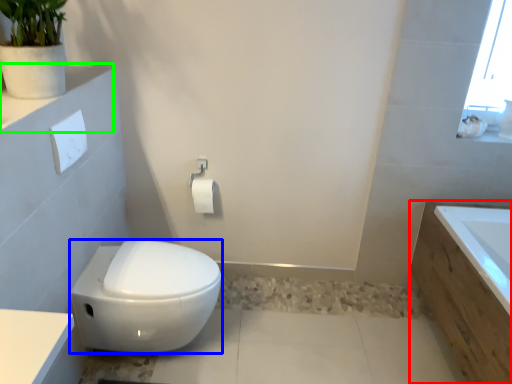
Question: Which is nearer to the bath (highlighted by a red box)? bidet (highlighted by a blue box) or ledge (highlighted by a green box).

Choices:
 (A) bidet
 (B) ledge

Answer: (A)